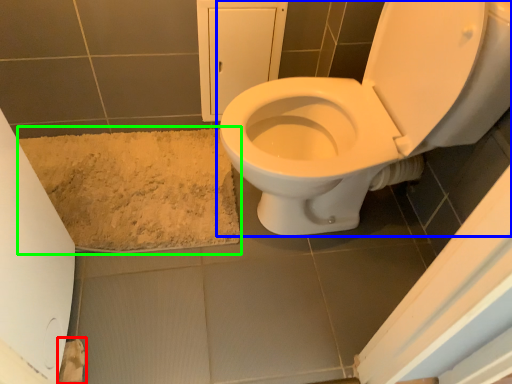
Question: Estimate the real-world distances between objects in this image. Which object is farther from toilet paper (highlighted by a red box), toilet (highlighted by a blue box) or bath mat (highlighted by a green box)?

Choices:
 (A) toilet
 (B) bath mat

Answer: (A)